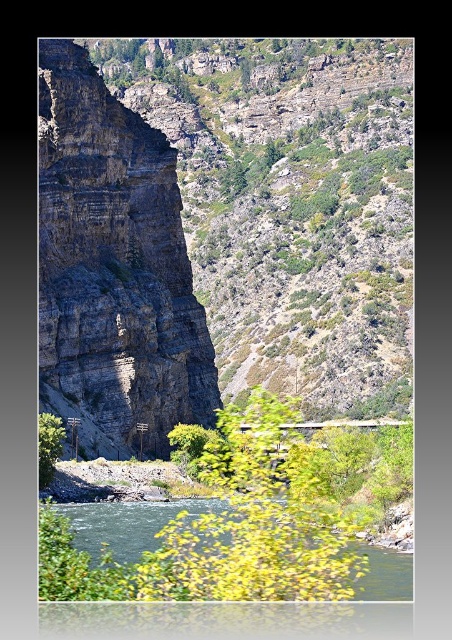
You are standing at the edge of the canyon and see two points marked in the image. Which point is closer to you, point (67,244) or point (43,458)?

Point (43,458) is closer to you because it is less further to the camera than point (67,244).

You are standing at the edge of the canyon and want to determine which of the two points, point (235,465) or point (139,513), is nearer to you. Based on the scene description, which point is closer?

Point (235,465) is closer to the viewer than point (139,513).